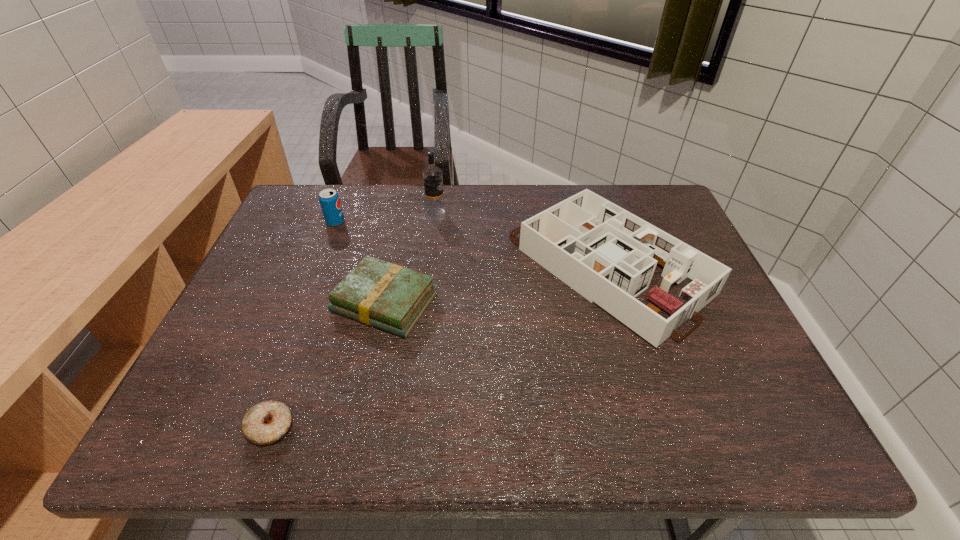
Find the location of a particular element. free space that is in between the nearest object and the tallest object is located at coordinates (353, 320).

This screenshot has width=960, height=540. I want to click on object that ranks as the second closest to the rightmost object, so click(x=377, y=293).

This screenshot has width=960, height=540. I want to click on object that ranks as the closest to the dollhouse, so click(x=432, y=175).

This screenshot has height=540, width=960. I want to click on vacant space that satisfies the following two spatial constraints: 1. on the label of the tallest object; 2. on the front side of the shortest object, so click(410, 427).

The width and height of the screenshot is (960, 540). Identify the location of vacant point that satisfies the following two spatial constraints: 1. on the label of the tallest object; 2. on the right side of the dollhouse. (429, 267).